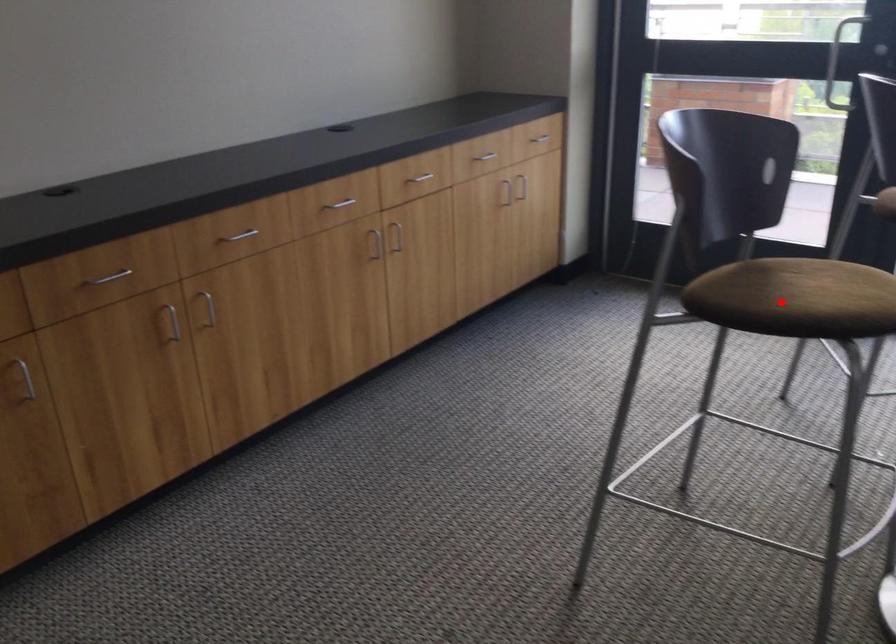
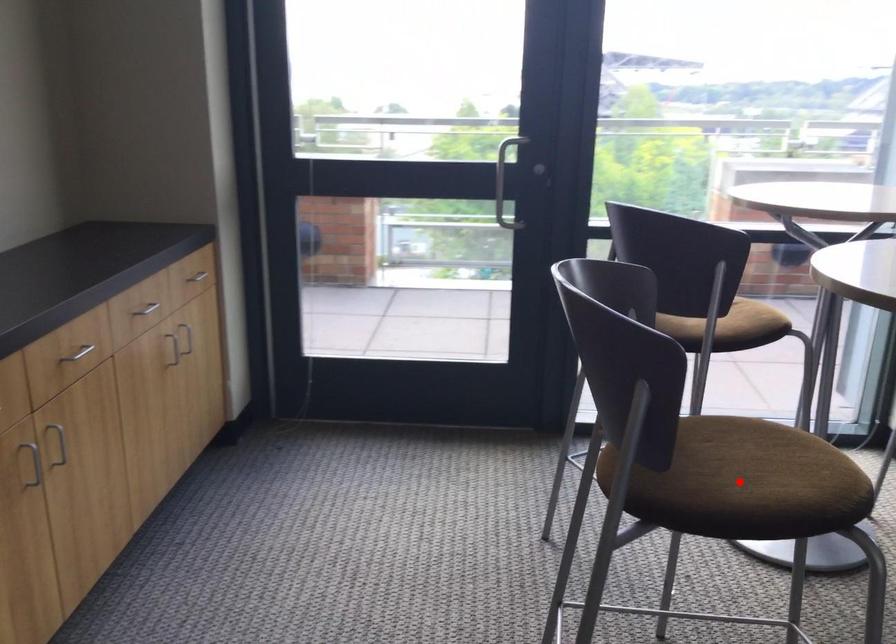
I am providing you with two images of the same scene from different viewpoints. A red point is marked on the first image and another point is marked on the second image. Do the highlighted points in image1 and image2 indicate the same real-world spot?

Yes